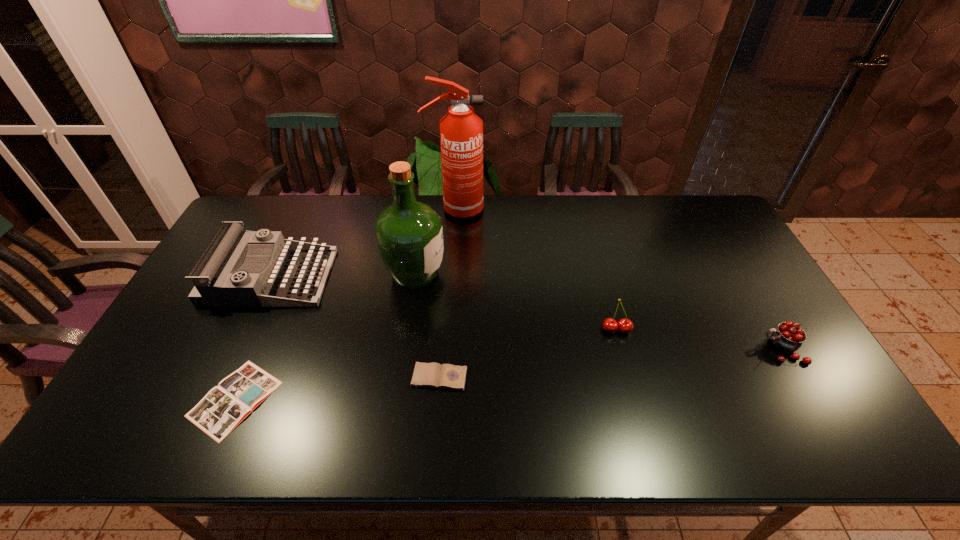
At what (x,y) coordinates should I click in order to perform the action: click on blank region between the second object from right to left and the typewriter. Please return your answer as a coordinate pair (x, y). Looking at the image, I should click on (444, 303).

You are a GUI agent. You are given a task and a screenshot of the screen. Output one action in this format:
    pyautogui.click(x=<x>, y=<y>)
    Task: Click on the vacant area between the second shortest object and the second tallest object
    
    Given the screenshot: What is the action you would take?
    pyautogui.click(x=427, y=326)

You are a GUI agent. You are given a task and a screenshot of the screen. Output one action in this format:
    pyautogui.click(x=<x>, y=<y>)
    Task: Click on the vacant space that is in between the tallest object and the typewriter
    
    Given the screenshot: What is the action you would take?
    pyautogui.click(x=363, y=243)

The image size is (960, 540). I want to click on vacant area between the liquor and the sixth object from left to right, so click(x=516, y=302).

I want to click on unoccupied position between the sixth shortest object and the rightmost object, so click(x=599, y=312).

Locate an element on the screen. The image size is (960, 540). unoccupied position between the sixth object from left to right and the liquor is located at coordinates (516, 302).

This screenshot has width=960, height=540. Identify the location of object that is the third closest to the sixth object from left to right. (409, 234).

Point out which object is positioned as the sixth nearest to the typewriter. Please provide its 2D coordinates. Your answer should be formatted as a tuple, i.e. [(x, y)], where the tuple contains the x and y coordinates of a point satisfying the conditions above.

[(788, 337)]

The image size is (960, 540). What are the coordinates of `vacant space that satisfies the following two spatial constraints: 1. on the typing side of the typewriter; 2. on the handle side of the rightmost object` in the screenshot? It's located at (236, 349).

Identify the location of free spot that satisfies the following two spatial constraints: 1. on the typing side of the book; 2. on the left side of the typewriter. (212, 399).